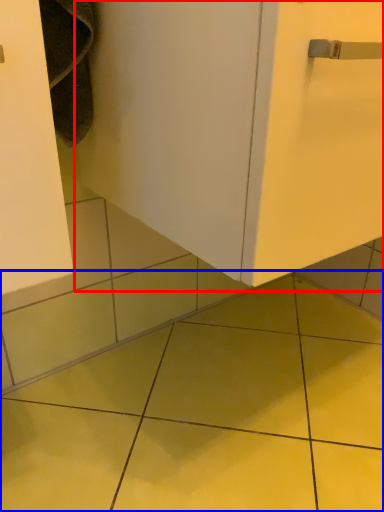
Question: Which object appears farthest to the camera in this image, door (highlighted by a red box) or ceramic tile (highlighted by a blue box)?

Choices:
 (A) door
 (B) ceramic tile

Answer: (B)